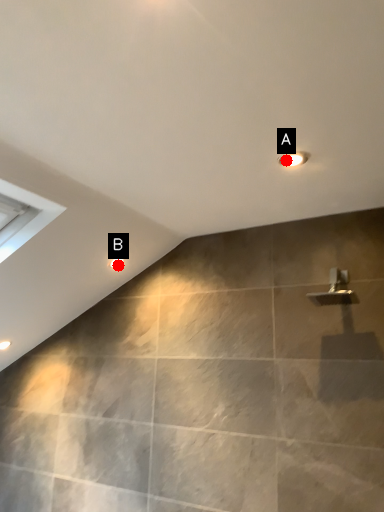
Question: Two points are circled on the image, labeled by A and B beside each circle. Which point is closer to the camera?

Choices:
 (A) A is closer
 (B) B is closer

Answer: (A)